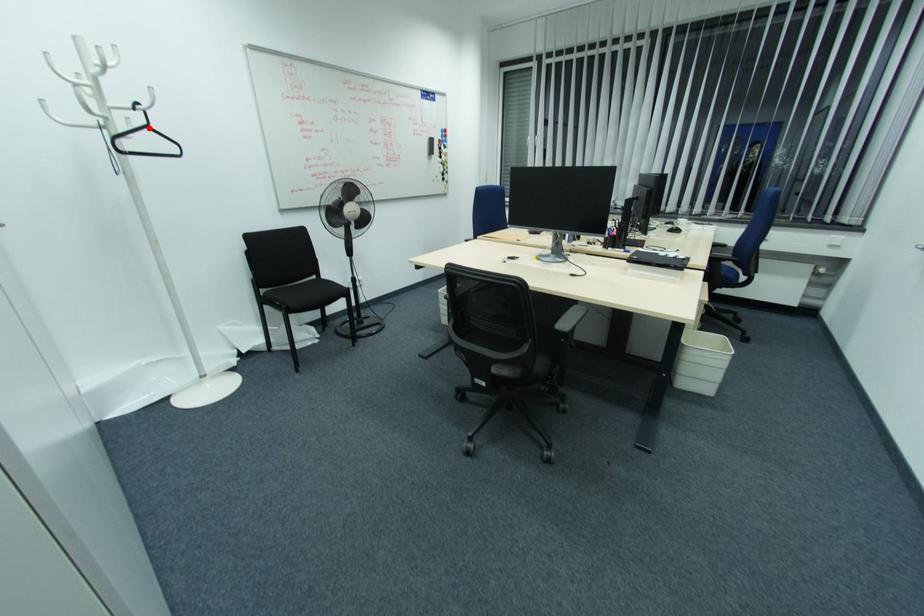
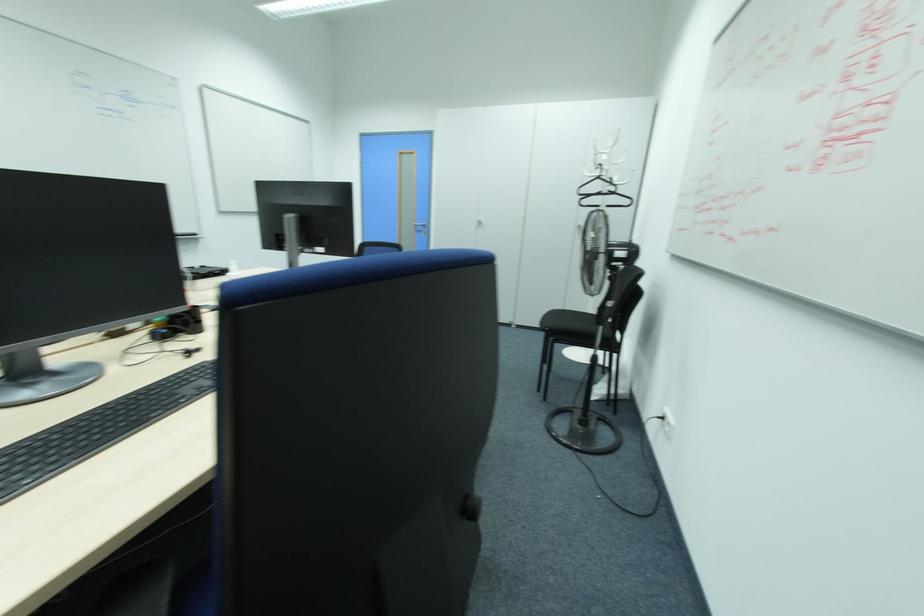
Question: A red point is marked in image1. In image2, is the corresponding 3D point closer to the camera or farther? Reply with the corresponding letter.

Choices:
 (A) The corresponding 3D point is closer.
 (B) The corresponding 3D point is farther.

Answer: (A)